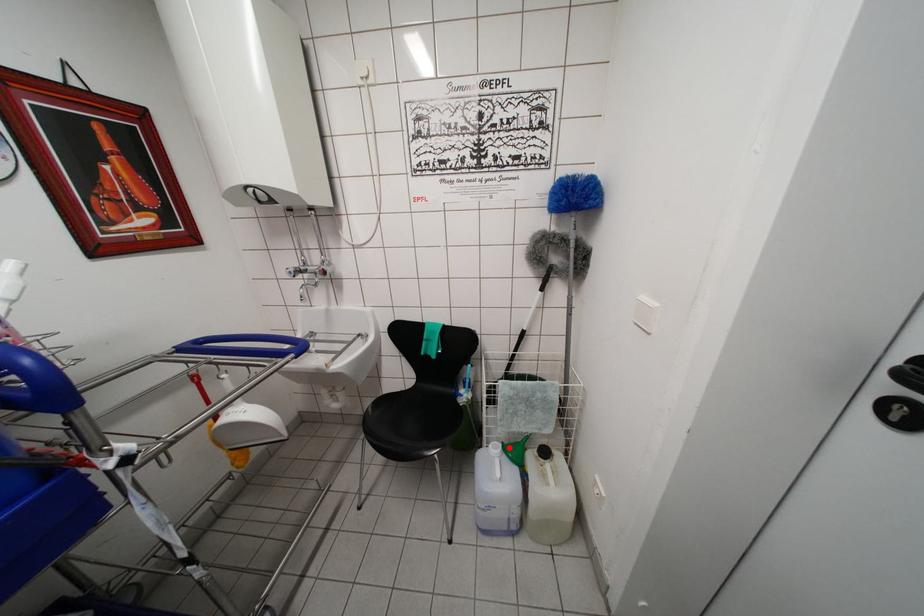
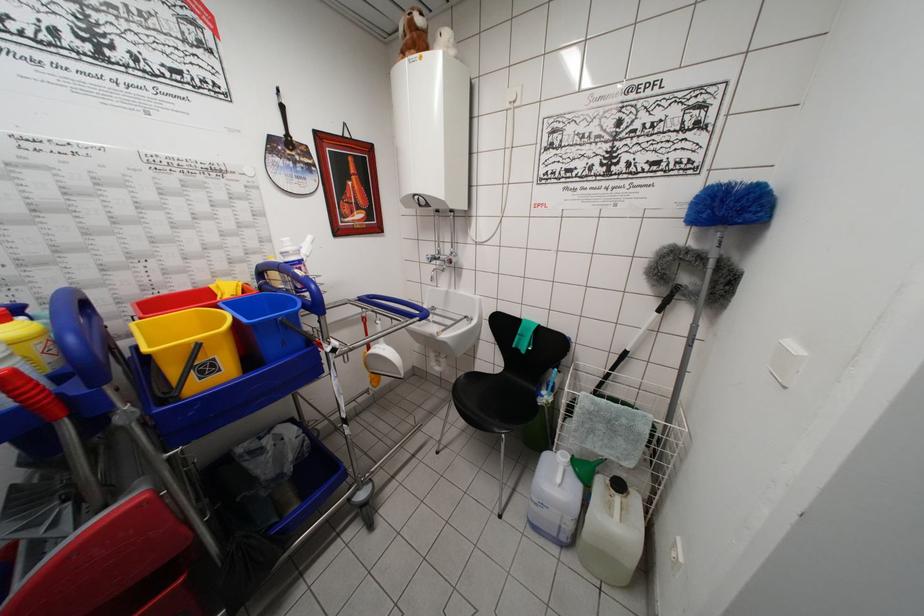
The point at the highlighted location is marked in the first image. Where is the corresponding point in the second image?

(579, 462)